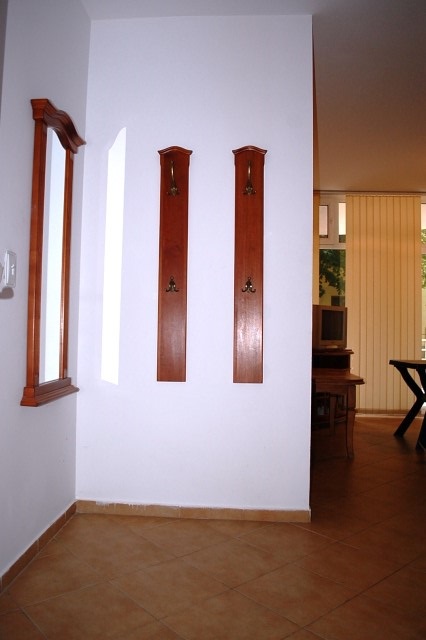
The width and height of the screenshot is (426, 640). I want to click on wall, so click(183, 392), click(21, 477).